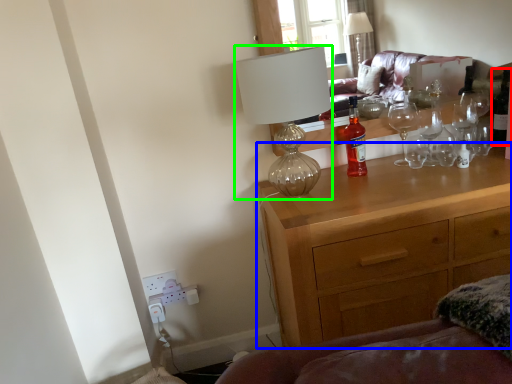
Question: Based on their relative distances, which object is nearer to wine bottle (highlighted by a red box)? Choose from chest of drawers (highlighted by a blue box) and lamp (highlighted by a green box).

Choices:
 (A) chest of drawers
 (B) lamp

Answer: (A)